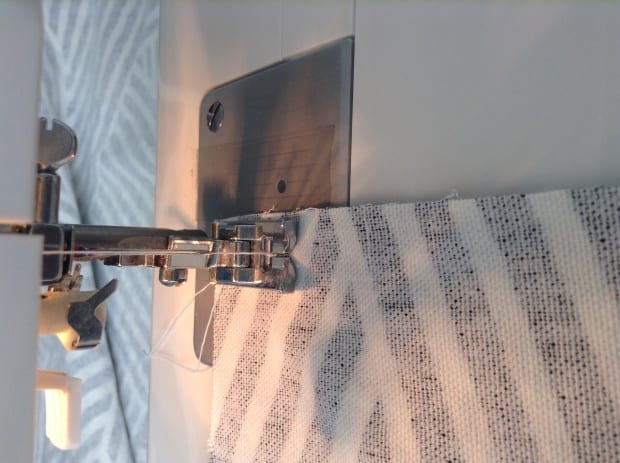
Identify the location of fabric. The width and height of the screenshot is (620, 463). (471, 341).